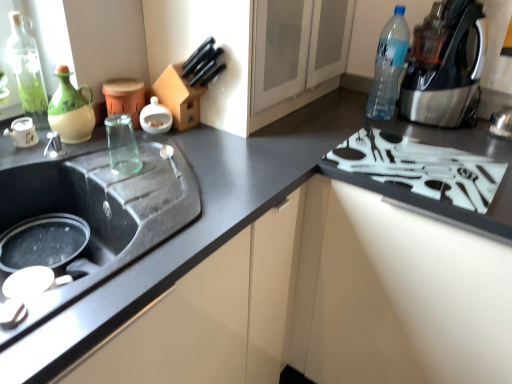
Question: Is white plastic gas stove at right bigger or smaller than matte glass jar at upper left, arranged as the 2th appliance when viewed from the left?

Choices:
 (A) small
 (B) big

Answer: (B)

Question: Based on their positions, is white plastic gas stove at right located to the left or right of matte glass jar at upper left, arranged as the 2th appliance when viewed from the left?

Choices:
 (A) right
 (B) left

Answer: (A)

Question: Based on their relative distances, which object is nearer to the white matte teapot at left, marked as the first appliance in a left-to-right arrangement?

Choices:
 (A) green matte teapot at left
 (B) black plastic coffee machine at upper right
 (C) matte glass jar at upper left, arranged as the 2th appliance when viewed from the left
 (D) black matte sink at left
 (E) stainless steel kettle at upper right, arranged as the 3th appliance when viewed from the left

Answer: (A)

Question: Which object is positioned closest to the blue plastic bottle at upper right, placed as the 2th bottle when sorted from left to right?

Choices:
 (A) white matte teapot at left, marked as the first appliance in a left-to-right arrangement
 (B) black plastic coffee machine at upper right
 (C) stainless steel kettle at upper right, arranged as the 3th appliance when viewed from the left
 (D) matte glass jar at upper left, arranged as the 2th appliance when viewed from the left
 (E) green glass bottle at upper left, the second bottle from the right

Answer: (B)